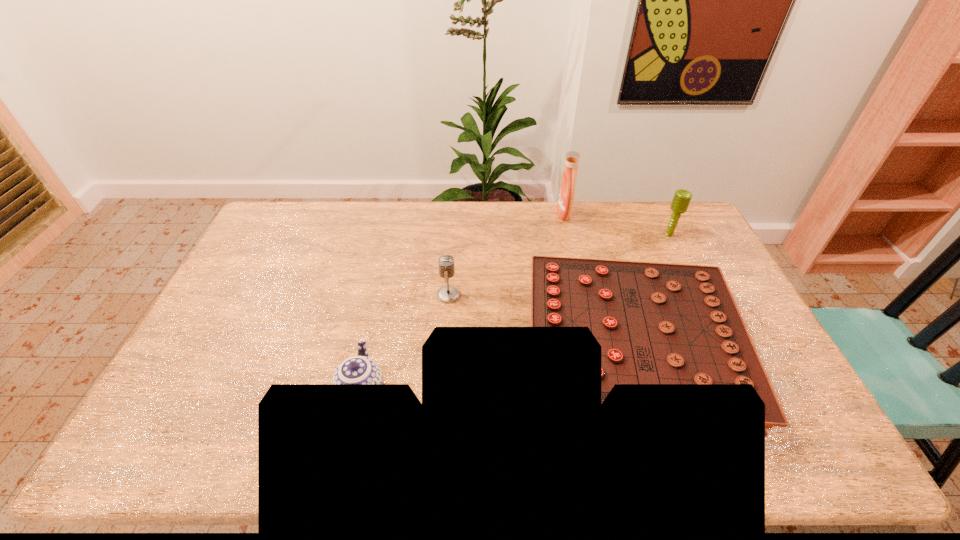
The image size is (960, 540). In order to click on free space that satisfies the following two spatial constraints: 1. at the spout of the chinaware; 2. on the left side of the fourth nearest object in this screenshot , I will do `click(396, 235)`.

This screenshot has width=960, height=540. In order to click on free location that satisfies the following two spatial constraints: 1. on the front-facing side of the farthest object; 2. on the left side of the second farthest object in this screenshot , I will do `click(569, 235)`.

The height and width of the screenshot is (540, 960). I want to click on free region that satisfies the following two spatial constraints: 1. on the back side of the right microphone; 2. on the front-facing side of the detergent, so click(x=659, y=214).

The height and width of the screenshot is (540, 960). What are the coordinates of `vacant region that satisfies the following two spatial constraints: 1. on the front-facing side of the farthest object; 2. on the back side of the gameboard` in the screenshot? It's located at (595, 349).

Locate an element on the screen. free space that satisfies the following two spatial constraints: 1. at the spout of the farther microphone; 2. on the right side of the chinaware is located at coordinates (396, 235).

Find the location of a particular element. free spot that satisfies the following two spatial constraints: 1. at the spout of the chinaware; 2. on the right side of the gameboard is located at coordinates (371, 349).

The height and width of the screenshot is (540, 960). In order to click on vacant space that satisfies the following two spatial constraints: 1. on the front-facing side of the farthest object; 2. on the left side of the gameboard in this screenshot , I will do `click(595, 349)`.

This screenshot has height=540, width=960. What are the coordinates of `vacant space that satisfies the following two spatial constraints: 1. at the spout of the gameboard; 2. on the left side of the leftmost object` in the screenshot? It's located at (371, 349).

You are a GUI agent. You are given a task and a screenshot of the screen. Output one action in this format:
    pyautogui.click(x=<x>, y=<y>)
    Task: Click on the free location that satisfies the following two spatial constraints: 1. at the spout of the gameboard; 2. on the right side of the chinaware
    
    Given the screenshot: What is the action you would take?
    pyautogui.click(x=371, y=349)